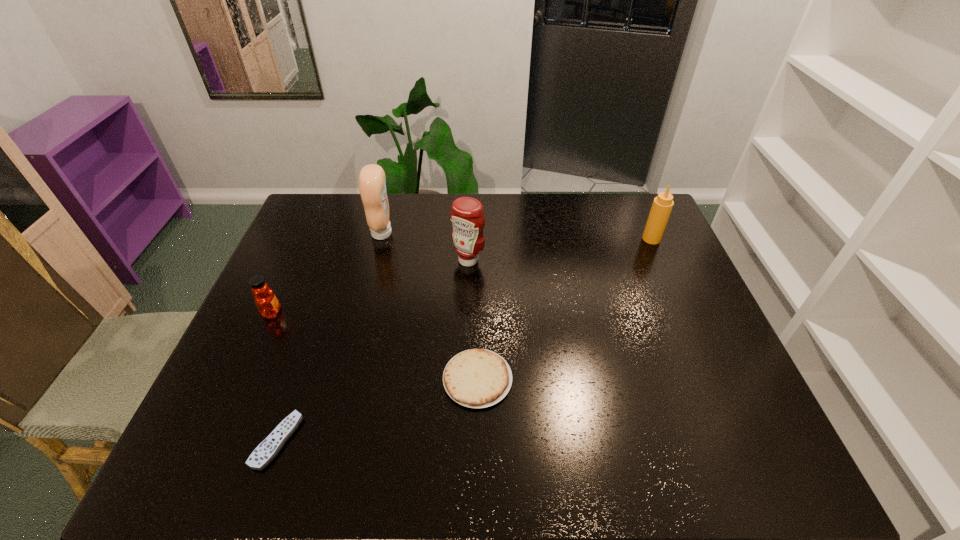
The height and width of the screenshot is (540, 960). Find the location of `free point between the fourth tallest object and the tortilla`. free point between the fourth tallest object and the tortilla is located at coordinates (374, 346).

Find the location of a particular element. The width and height of the screenshot is (960, 540). free space that is in between the nearest condiment and the rightmost object is located at coordinates (560, 249).

Where is `free spot between the remote control and the leftmost condiment`? Image resolution: width=960 pixels, height=540 pixels. free spot between the remote control and the leftmost condiment is located at coordinates (329, 337).

Find the location of a particular element. This screenshot has height=540, width=960. free spot between the fourth object from right to left and the fifth object from right to left is located at coordinates (329, 337).

I want to click on vacant space in between the third object from left to right and the second condiment from right to left, so click(x=425, y=247).

Locate an element on the screen. The image size is (960, 540). blank region between the fourth tallest object and the fourth object from right to left is located at coordinates (327, 273).

Find the location of a particular element. the third closest object to the nearest object is located at coordinates (467, 216).

Where is `object that ranks as the fourth closest to the shortest object`? object that ranks as the fourth closest to the shortest object is located at coordinates (372, 182).

The width and height of the screenshot is (960, 540). Identify the location of the second closest condiment relative to the rightmost condiment. (372, 182).

Locate an element on the screen. Image resolution: width=960 pixels, height=540 pixels. the third closest condiment to the leftmost object is located at coordinates (662, 205).